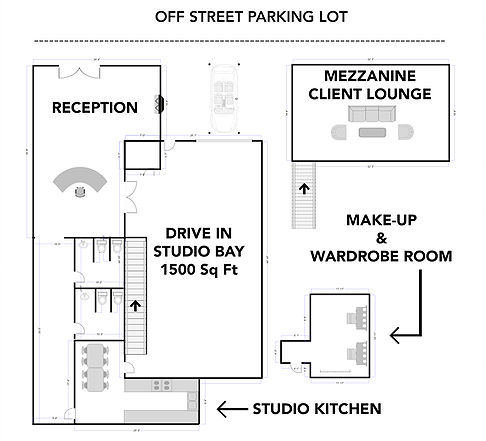
Image resolution: width=486 pixels, height=441 pixels. I want to click on counter space, so coord(140,384), coord(178,385), coord(165,414).